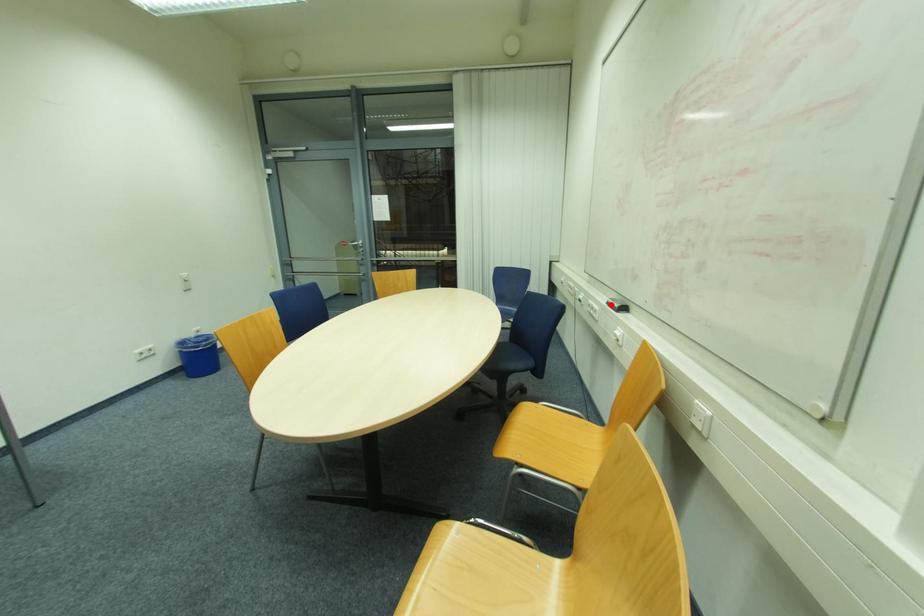
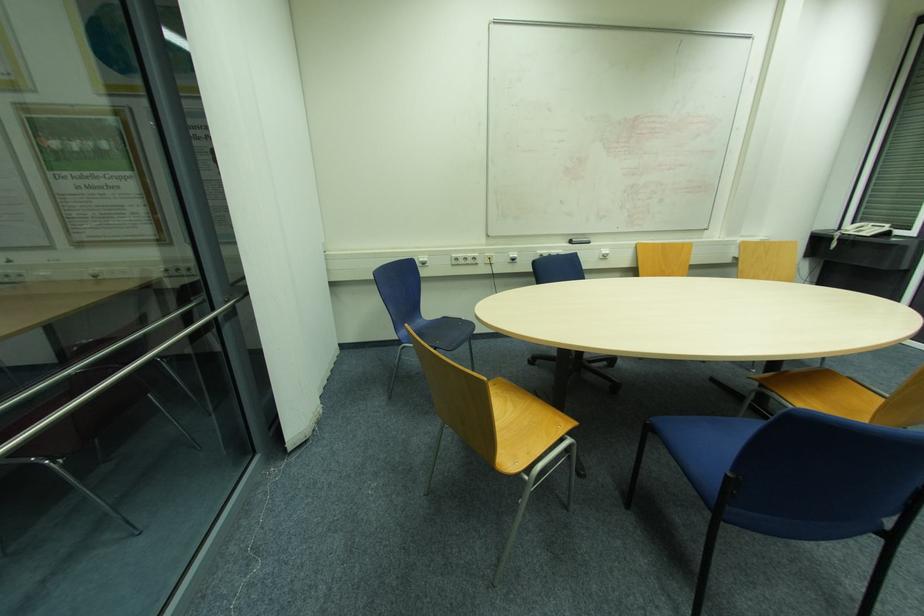
In the second image, find the point that corresponds to the highlighted location in the first image.

(574, 244)